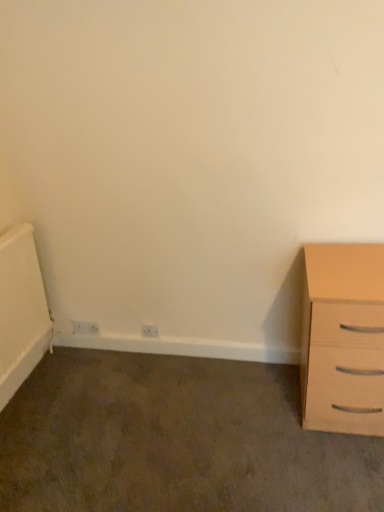
I want to click on empty space that is ontop of light wood chest of drawers at right (from a real-world perspective), so (x=354, y=257).